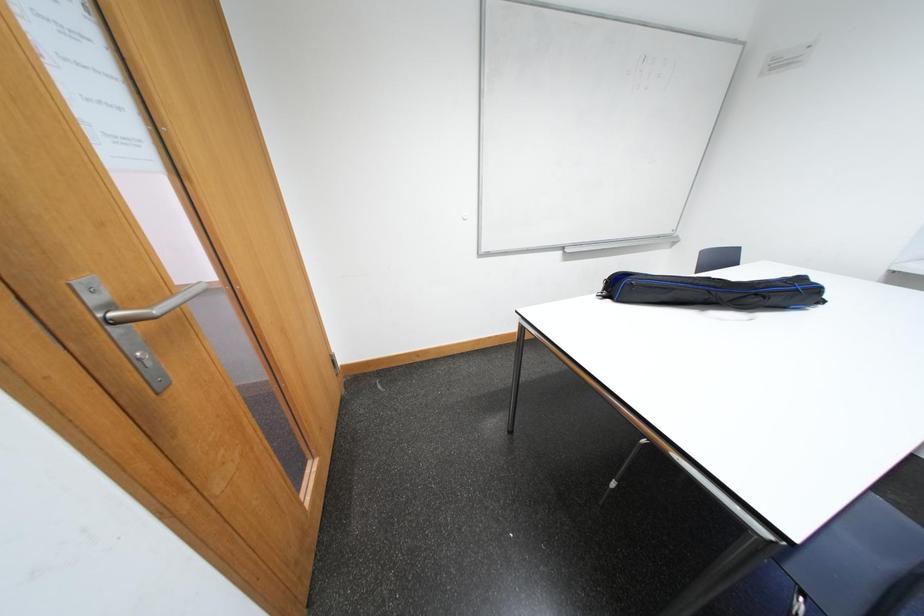
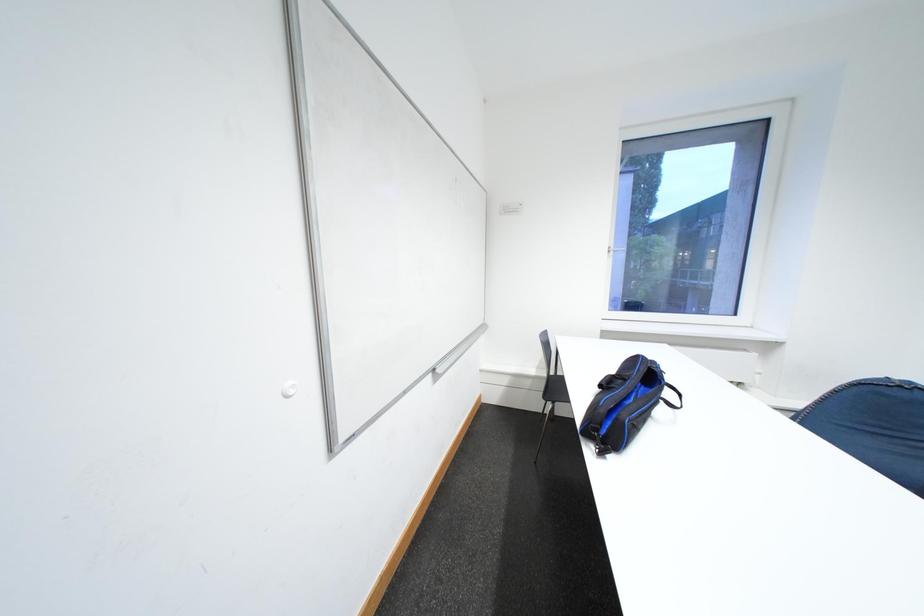
Question: The camera is either moving clockwise (left) or counter-clockwise (right) around the object. The first image is from the beginning of the video and the second image is from the end. Is the camera moving left or right when shooting the video?

Choices:
 (A) Left
 (B) Right

Answer: (A)